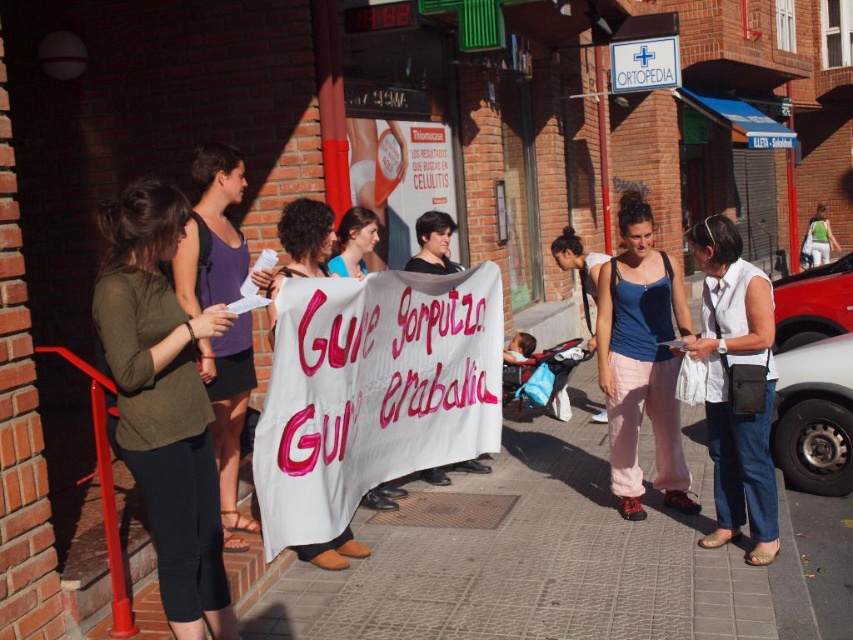
Question: Among these objects, which one is nearest to the camera?

Choices:
 (A) white plastic sign at upper center
 (B) matte blue tank top at center
 (C) white cotton shirt at center

Answer: (C)

Question: Considering the real-world distances, which object is farthest from the white paper banner at center?

Choices:
 (A) matte blue tank top at center
 (B) dark green jersey at center
 (C) white plastic sign at upper center
 (D) white cotton shirt at center

Answer: (C)

Question: Does dark green jersey at center come behind matte purple tank top at left?

Choices:
 (A) yes
 (B) no

Answer: (B)

Question: Is white cotton shirt at center smaller than matte blue tank top at center?

Choices:
 (A) no
 (B) yes

Answer: (A)

Question: Does matte blue tank top at center appear over matte purple tank top at left?

Choices:
 (A) yes
 (B) no

Answer: (B)

Question: Which point appears closest to the camera in this image?

Choices:
 (A) (648, 410)
 (B) (198, 632)
 (C) (711, 273)
 (D) (825, 211)

Answer: (B)